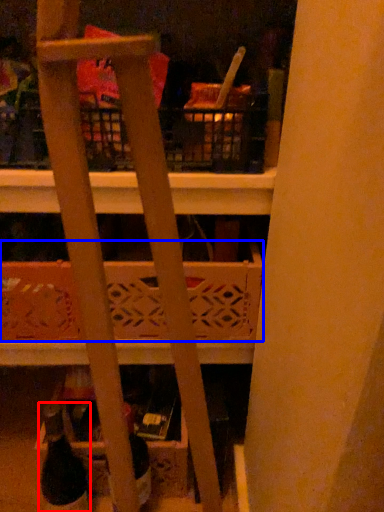
Question: Which of the following is the closest to the observer, wine bottle (highlighted by a red box) or basket (highlighted by a blue box)?

Choices:
 (A) wine bottle
 (B) basket

Answer: (A)